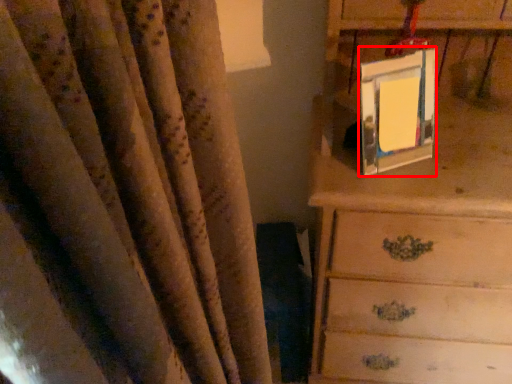
Question: In this image, where is picture frame (annotated by the red box) located relative to chest of drawers?

Choices:
 (A) left
 (B) right

Answer: (A)